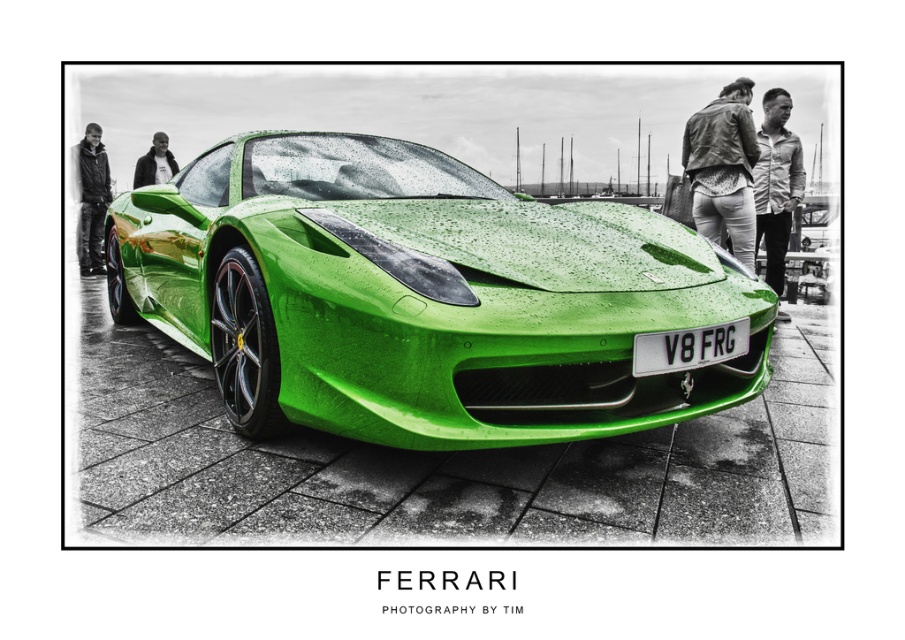
Question: Which of these objects is positioned farthest from the leather jacket at upper center?

Choices:
 (A) matte black jacket at upper left
 (B) black leather jacket at left
 (C) glossy green ferrari at center
 (D) black plastic license plate at center

Answer: (B)

Question: Can you confirm if glossy green ferrari at center is smaller than matte black jacket at upper left?

Choices:
 (A) yes
 (B) no

Answer: (B)

Question: Does light brown leather jacket at upper right appear on the left side of black leather jacket at left?

Choices:
 (A) no
 (B) yes

Answer: (A)

Question: Which of the following is the closest to the observer?

Choices:
 (A) (696, 186)
 (B) (140, 170)
 (C) (100, 273)

Answer: (A)

Question: Can you confirm if glossy green ferrari at center is bigger than matte black jacket at upper left?

Choices:
 (A) yes
 (B) no

Answer: (A)

Question: Estimate the real-world distances between objects in this image. Which object is farther from the glossy green ferrari at center?

Choices:
 (A) leather jacket at upper center
 (B) matte black jacket at upper left
 (C) light brown leather jacket at upper right
 (D) black leather jacket at left

Answer: (B)